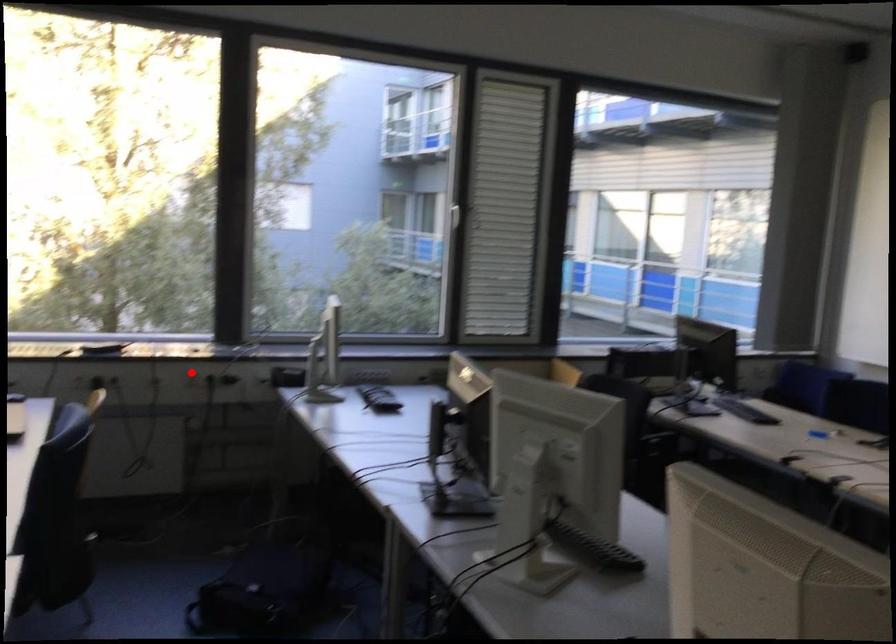
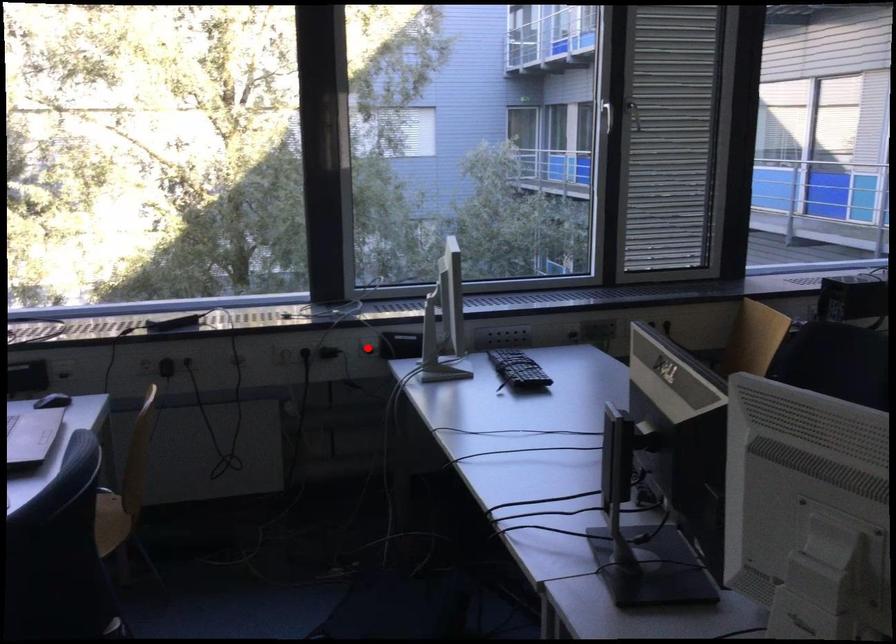
I am providing you with two images of the same scene from different viewpoints. A red point is marked on the first image and another point is marked on the second image. Does the point marked in image1 correspond to the same location as the one in image2?

No